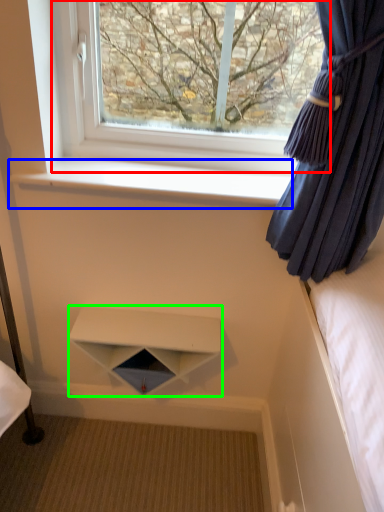
Question: Estimate the real-world distances between objects in this image. Which object is closer to window (highlighted by a red box), window sill (highlighted by a blue box) or shelf (highlighted by a green box)?

Choices:
 (A) window sill
 (B) shelf

Answer: (A)